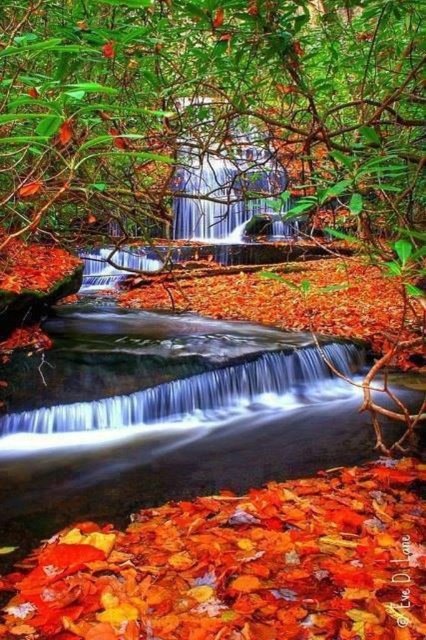
Question: Can you confirm if shiny red leaves at center is thinner than smooth water at center?

Choices:
 (A) yes
 (B) no

Answer: (A)

Question: Does shiny red leaves at center have a lesser width compared to white smooth water at center?

Choices:
 (A) yes
 (B) no

Answer: (A)

Question: Based on their relative distances, which object is nearer to the white smooth water at center?

Choices:
 (A) smooth water at center
 (B) shiny red leaves at center

Answer: (A)

Question: Can you confirm if shiny red leaves at center is smaller than smooth water at center?

Choices:
 (A) no
 (B) yes

Answer: (B)

Question: Which point is farther from the camera taking this photo?

Choices:
 (A) (106, 502)
 (B) (184, 378)
 (C) (172, 572)

Answer: (B)

Question: Estimate the real-world distances between objects in this image. Which object is closer to the smooth water at center?

Choices:
 (A) white smooth water at center
 (B) shiny red leaves at center

Answer: (A)